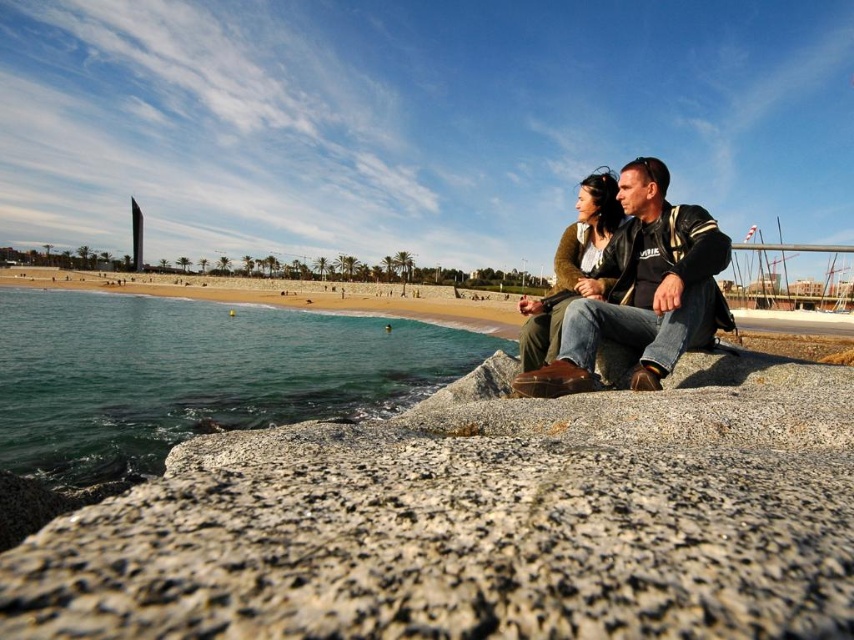
You are standing at the point marked by the coordinates point (194,374) in the image. Looking around, you see the green water at lower left. Which direction should you walk to reach the sandy shore?

The point marked by the coordinates point (194,374) is at the green water at lower left. To reach the sandy shore, you should walk towards the right since the sandy shore is located to the east of the green water at lower left.

You are standing at the camera position and want to reach the two points marked in the image. Which point, point (115, 401) or point (443, 307), would you reach first as you move forward?

You would reach point (115, 401) first because it is closer to the camera than point (443, 307).

You are standing on the beach and see the granite rock at center and the leather jacket at center. Which object is closer to the ground?

The granite rock at center is located below the leather jacket at center, so it is closer to the ground.